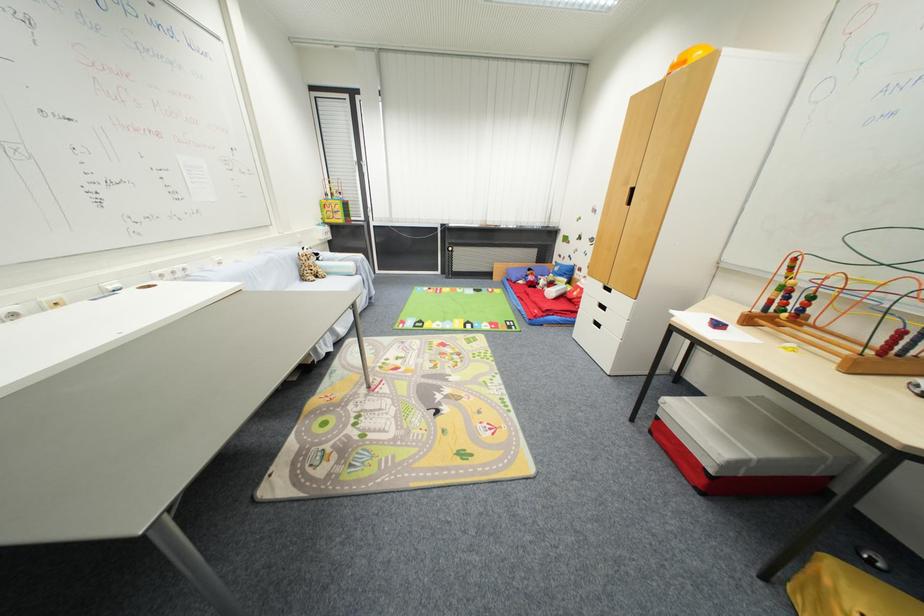
The height and width of the screenshot is (616, 924). In order to click on black cabinet handle in this screenshot , I will do `click(629, 196)`.